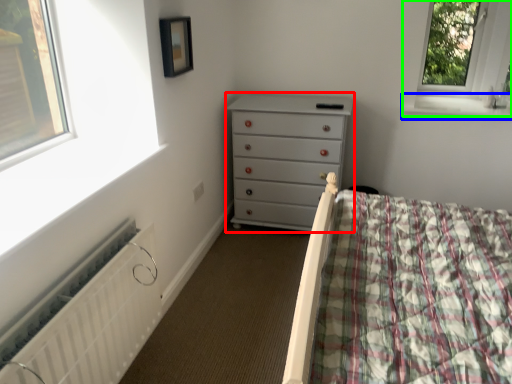
Question: Estimate the real-world distances between objects in this image. Which object is closer to chest of drawers (highlighted by a red box), window sill (highlighted by a blue box) or window (highlighted by a green box)?

Choices:
 (A) window sill
 (B) window

Answer: (A)